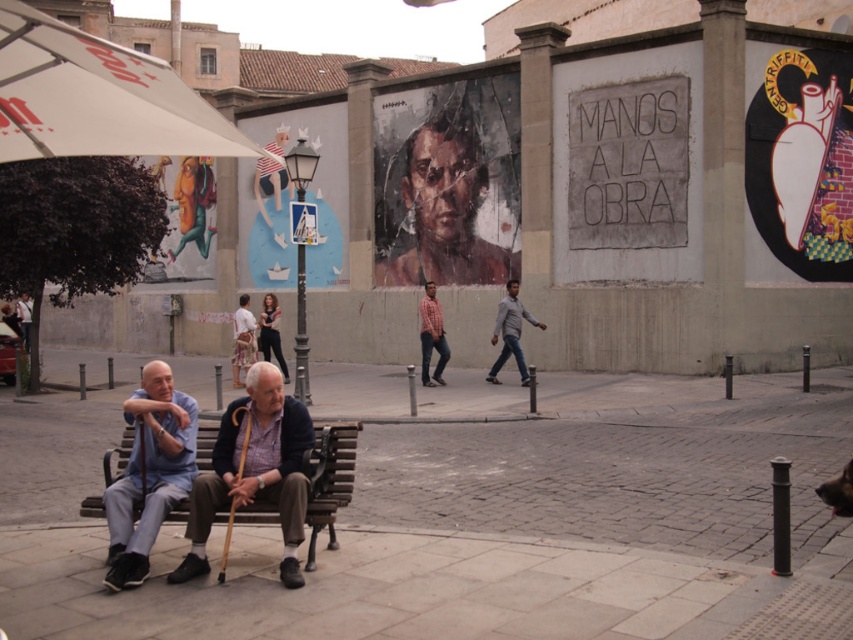
Question: Does light brown wooden cane at center appear over red plaid shirt at center?

Choices:
 (A) no
 (B) yes

Answer: (A)

Question: Which point is farther to the camera?

Choices:
 (A) pyautogui.click(x=148, y=72)
 (B) pyautogui.click(x=286, y=540)
 (C) pyautogui.click(x=248, y=353)

Answer: (C)

Question: Considering the relative positions of light brown wooden cane at center and brown wooden bench at center in the image provided, where is light brown wooden cane at center located with respect to brown wooden bench at center?

Choices:
 (A) above
 (B) below

Answer: (A)

Question: Is brown wooden bench at center bigger than light brown fabric shirt at center?

Choices:
 (A) no
 (B) yes

Answer: (A)

Question: Which of the following is the closest to the observer?

Choices:
 (A) oil painting portrait at center
 (B) light gray sweater at center

Answer: (B)

Question: Considering the real-world distances, which object is closest to the light brown wooden cane at center?

Choices:
 (A) oil painting portrait at center
 (B) dark blue jeans at center

Answer: (B)